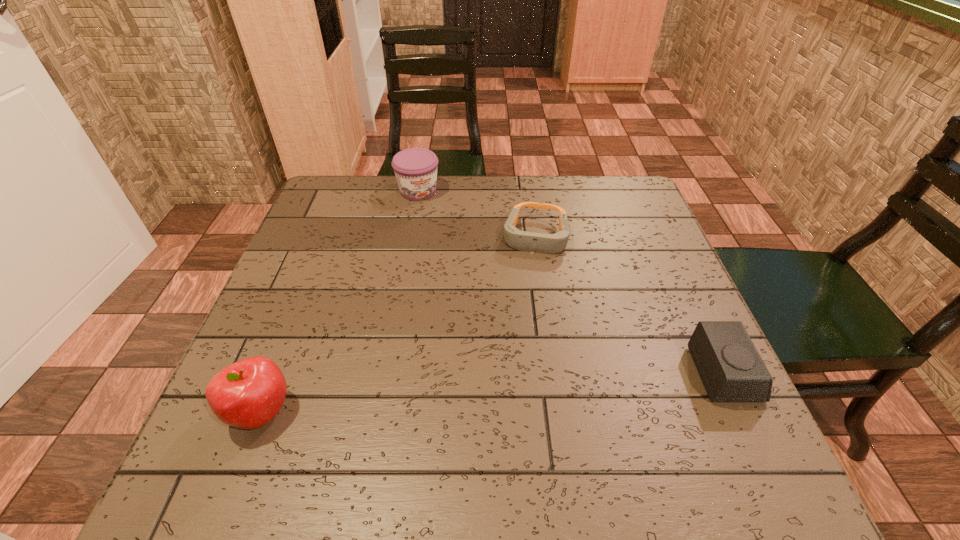
This screenshot has width=960, height=540. I want to click on object located in the right edge section of the desktop, so click(731, 369).

Find the location of a particular element. The image size is (960, 540). object that is at the near left corner is located at coordinates (249, 393).

What are the coordinates of `object at the near right corner` in the screenshot? It's located at (731, 369).

In the image, there is a desktop. Identify the location of vacant region at the far edge. (585, 207).

The height and width of the screenshot is (540, 960). In the image, there is a desktop. Identify the location of vacant region at the near edge. (497, 394).

The width and height of the screenshot is (960, 540). What are the coordinates of `vacant space at the left edge of the desktop` in the screenshot? It's located at (306, 278).

Identify the location of vacant space at the right edge of the desktop. (666, 352).

Image resolution: width=960 pixels, height=540 pixels. In the image, there is a desktop. In order to click on vacant space at the far left corner in this screenshot , I will do `click(332, 221)`.

Identify the location of free space at the far right corner. (612, 175).

You are a GUI agent. You are given a task and a screenshot of the screen. Output one action in this format:
    pyautogui.click(x=<x>, y=<y>)
    Task: Click on the free spot between the jam and the apple
    Image resolution: width=960 pixels, height=540 pixels.
    Given the screenshot: What is the action you would take?
    pyautogui.click(x=340, y=301)